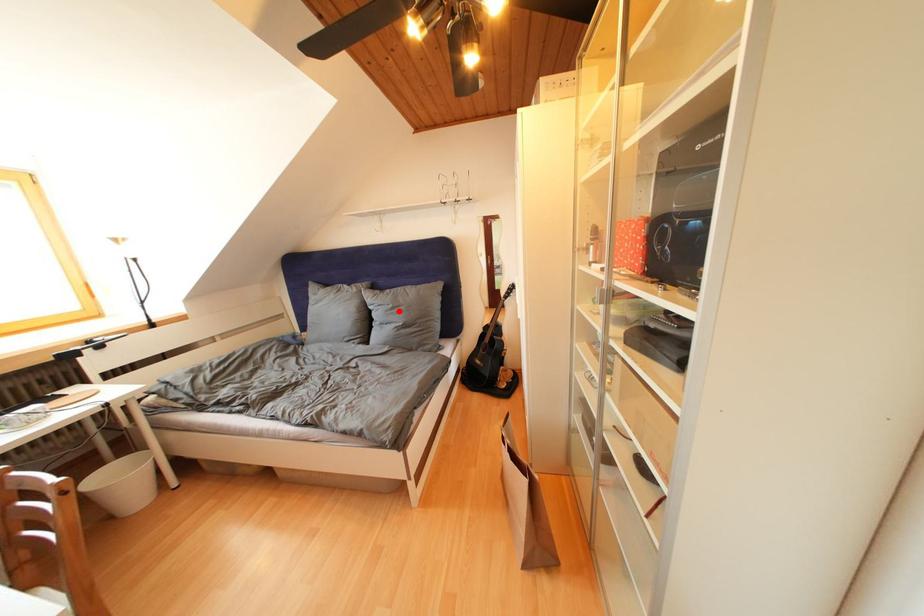
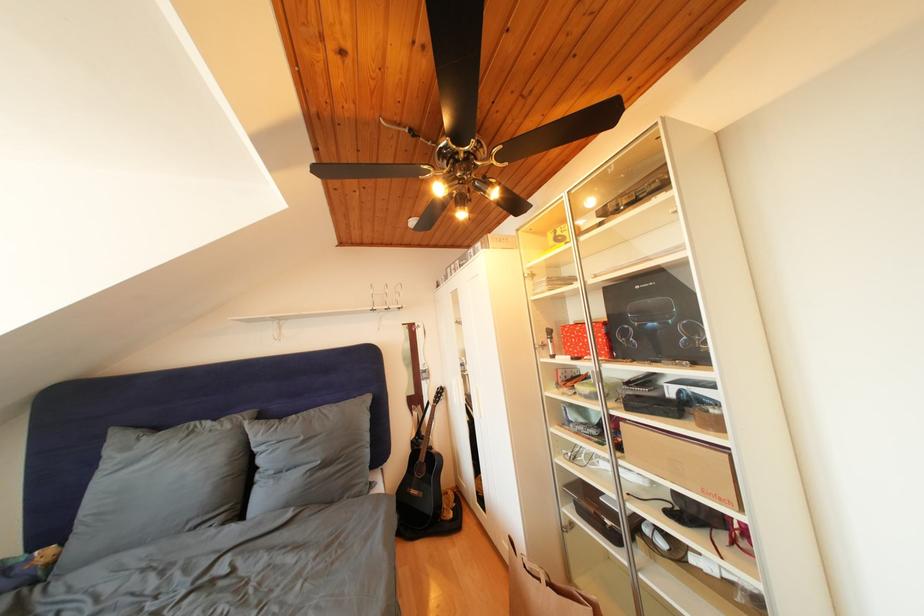
Find the pixel in the second image that matches the highlighted location in the first image.

(310, 444)